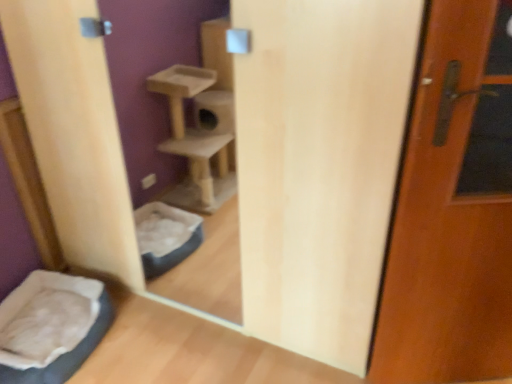
Where is `brown wooden door at right`? brown wooden door at right is located at coordinates (453, 208).

The width and height of the screenshot is (512, 384). What do you see at coordinates (453, 208) in the screenshot?
I see `brown wooden door at right` at bounding box center [453, 208].

Locate an element on the screen. This screenshot has height=384, width=512. soft white fabric at lower left is located at coordinates (51, 327).

Image resolution: width=512 pixels, height=384 pixels. What do you see at coordinates (51, 327) in the screenshot?
I see `soft white fabric at lower left` at bounding box center [51, 327].

At what (x,y) coordinates should I click in order to perform the action: click on brown wooden door at right. Please return your answer as a coordinate pair (x, y). The width and height of the screenshot is (512, 384). Looking at the image, I should click on (453, 208).

Considering the positions of objects brown wooden door at right and soft white fabric at lower left in the image provided, who is more to the left, brown wooden door at right or soft white fabric at lower left?

From the viewer's perspective, soft white fabric at lower left appears more on the left side.

Considering the positions of objects brown wooden door at right and soft white fabric at lower left in the image provided, who is behind, brown wooden door at right or soft white fabric at lower left?

soft white fabric at lower left is more distant.

Considering the points (413, 162) and (78, 289), which point is in front, point (413, 162) or point (78, 289)?

The point (413, 162) is in front.

From the image's perspective, who appears lower, brown wooden door at right or soft white fabric at lower left?

From the image's view, soft white fabric at lower left is below.

From a real-world perspective, is brown wooden door at right positioned under soft white fabric at lower left based on gravity?

No.

Based on the photo, looking at their sizes, would you say brown wooden door at right is wider or thinner than soft white fabric at lower left?

In the image, brown wooden door at right appears to be more narrow than soft white fabric at lower left.

Considering the sizes of objects brown wooden door at right and soft white fabric at lower left in the image provided, who is taller, brown wooden door at right or soft white fabric at lower left?

Standing taller between the two is brown wooden door at right.

Considering the sizes of objects brown wooden door at right and soft white fabric at lower left in the image provided, who is smaller, brown wooden door at right or soft white fabric at lower left?

brown wooden door at right is smaller.

Is soft white fabric at lower left surrounded by brown wooden door at right?

No, soft white fabric at lower left is located outside of brown wooden door at right.

Would you say brown wooden door at right is a long distance from soft white fabric at lower left?

Yes.

Could you tell me if brown wooden door at right is facing soft white fabric at lower left?

No.

What's the angular difference between brown wooden door at right and soft white fabric at lower left's facing directions?

The angle between the facing direction of brown wooden door at right and the facing direction of soft white fabric at lower left is 71.5 degrees.

In the image, there is a soft white fabric at lower left. Where is `door above it (from the image's perspective)`? This screenshot has width=512, height=384. door above it (from the image's perspective) is located at coordinates (453, 208).

Would you say soft white fabric at lower left is to the left or to the right of brown wooden door at right in the picture?

soft white fabric at lower left is to the left of brown wooden door at right.

Does soft white fabric at lower left come behind brown wooden door at right?

Yes, soft white fabric at lower left is further from the camera.

Considering the points (86, 327) and (450, 258), which point is in front, point (86, 327) or point (450, 258)?

The point (450, 258) is in front.

From the image's perspective, which one is positioned higher, soft white fabric at lower left or brown wooden door at right?

brown wooden door at right.

From a real-world perspective, relative to brown wooden door at right, is soft white fabric at lower left vertically above or below?

In terms of real-world spatial position, soft white fabric at lower left is below brown wooden door at right.

Can you confirm if soft white fabric at lower left is wider than brown wooden door at right?

Indeed, soft white fabric at lower left has a greater width compared to brown wooden door at right.

From their relative heights in the image, would you say soft white fabric at lower left is taller or shorter than brown wooden door at right?

In the image, soft white fabric at lower left appears to be shorter than brown wooden door at right.

Considering the relative sizes of soft white fabric at lower left and brown wooden door at right in the image provided, is soft white fabric at lower left smaller than brown wooden door at right?

No, soft white fabric at lower left is not smaller than brown wooden door at right.

Is soft white fabric at lower left surrounding brown wooden door at right?

Actually, brown wooden door at right is outside soft white fabric at lower left.

Is soft white fabric at lower left with brown wooden door at right?

There is a gap between soft white fabric at lower left and brown wooden door at right.

Is soft white fabric at lower left looking in the opposite direction of brown wooden door at right?

soft white fabric at lower left does not have its back to brown wooden door at right.

The height and width of the screenshot is (384, 512). I want to click on wide that is below the brown wooden door at right (from the image's perspective), so click(x=51, y=327).

Find the location of a particular element. wide below the brown wooden door at right (from a real-world perspective) is located at coordinates (51, 327).

What are the coordinates of `wide below the brown wooden door at right (from the image's perspective)` in the screenshot? It's located at (51, 327).